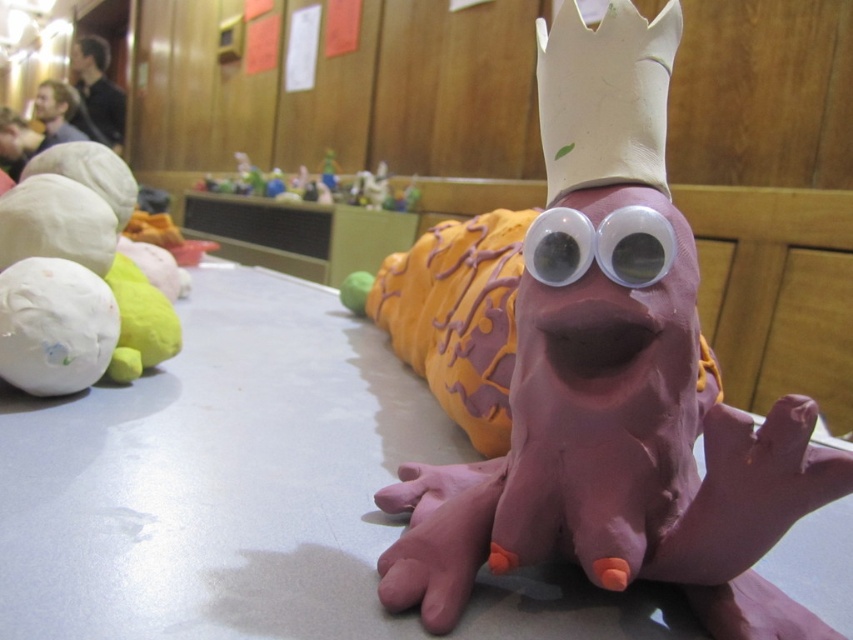
Question: Can you confirm if smooth plastic toys at center is positioned above translucent plastic eye at center?

Choices:
 (A) no
 (B) yes

Answer: (B)

Question: Considering the real-world distances, which object is closest to the translucent plastic eye at center?

Choices:
 (A) matte gray table at center
 (B) pink clay snail at center
 (C) blonde hair at upper left

Answer: (B)

Question: Which of the following is the farthest from the observer?

Choices:
 (A) white matte ball at upper left
 (B) pink clay snail at center
 (C) matte gray table at center
 (D) blonde hair at upper left

Answer: (D)

Question: Can you confirm if matte gray table at center is wider than translucent plastic eye at center?

Choices:
 (A) no
 (B) yes

Answer: (B)

Question: Among these points, which one is nearest to the camera?

Choices:
 (A) (53, 93)
 (B) (358, 198)
 (C) (233, 454)
 (D) (10, 115)

Answer: (C)

Question: Where is matte gray table at center located in relation to matte black hair at upper left in the image?

Choices:
 (A) right
 (B) left

Answer: (A)